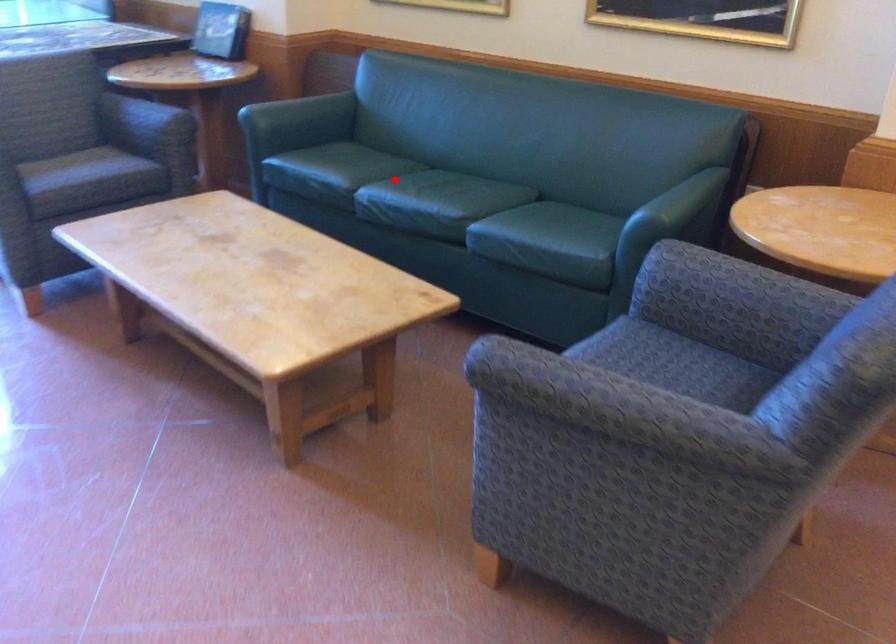
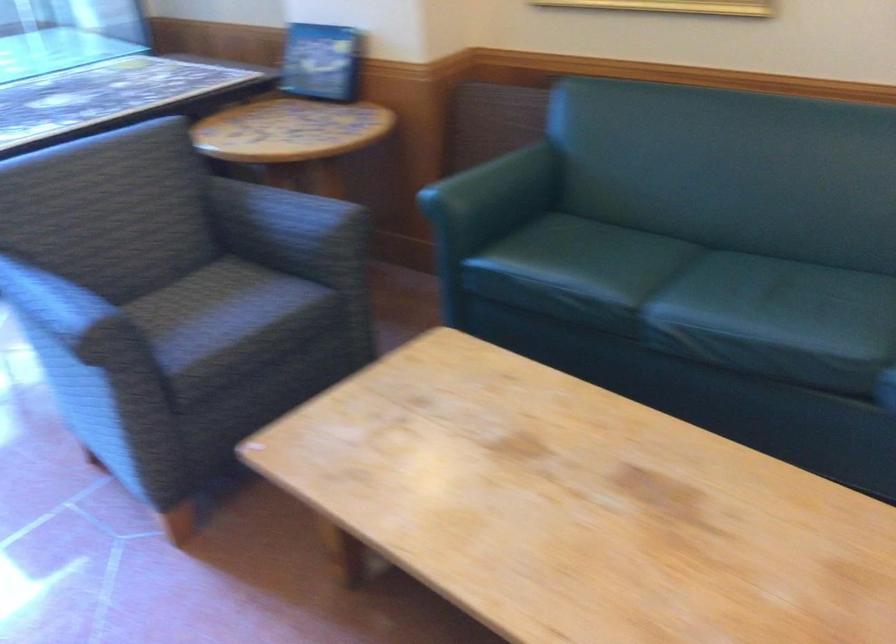
Question: I am providing you with two images of the same scene from different viewpoints. Given a red point in image1, look at the same physical point in image2. Is it:

Choices:
 (A) Closer to the viewpoint
 (B) Farther from the viewpoint

Answer: (A)